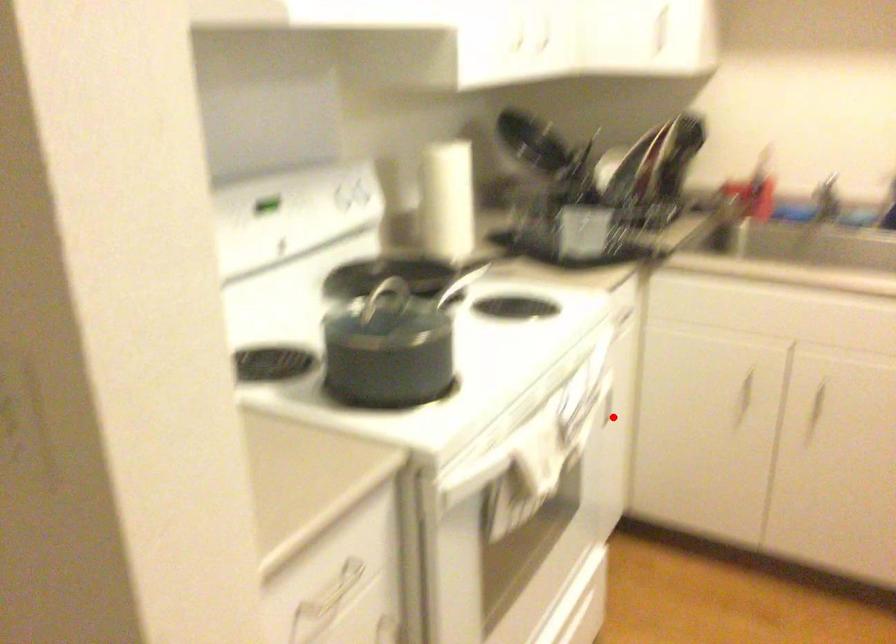
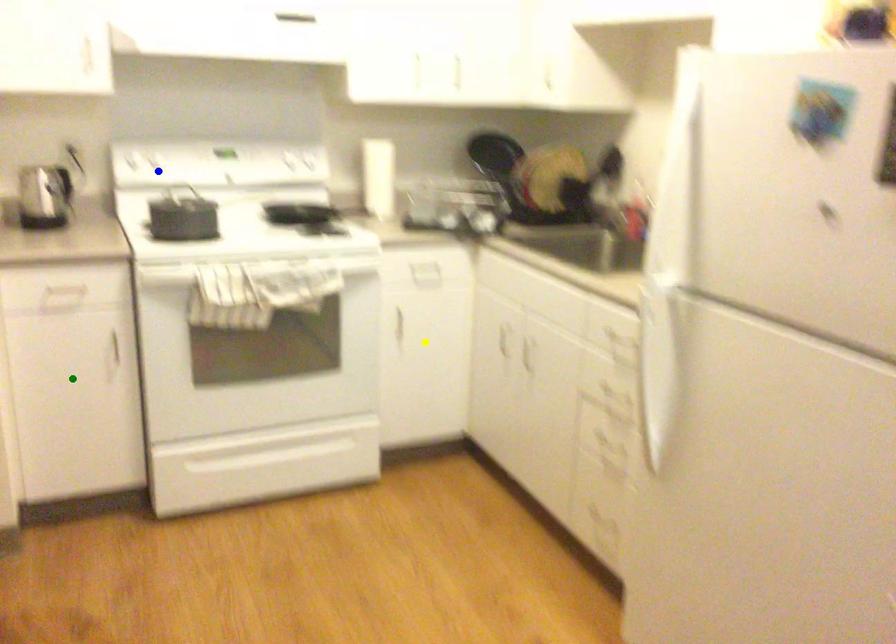
Question: I am providing you with two images of the same scene from different viewpoints. A red point is marked on the first image. You are given multiple points on the second image. Which point in image 2 represents the same 3d spot as the red point in image 1?

Choices:
 (A) blue point
 (B) green point
 (C) yellow point

Answer: (C)